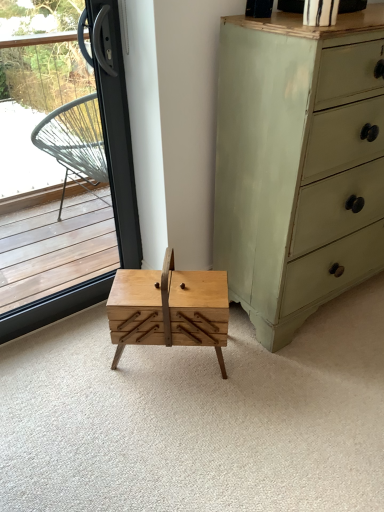
Question: Is point (276, 13) closer or farther from the camera than point (369, 406)?

Choices:
 (A) closer
 (B) farther

Answer: (A)

Question: From their relative heights in the image, would you say light green painted wood chest of drawers at right is taller or shorter than natural wood drawer at center?

Choices:
 (A) short
 (B) tall

Answer: (B)

Question: Considering the real-world distances, which object is farthest from the natural wood drawer at center?

Choices:
 (A) transparent glass window at left
 (B) natural wood table at center
 (C) light green painted wood chest of drawers at right

Answer: (A)

Question: Which object is the closest to the light green painted wood chest of drawers at right?

Choices:
 (A) transparent glass window at left
 (B) natural wood table at center
 (C) natural wood drawer at center

Answer: (B)